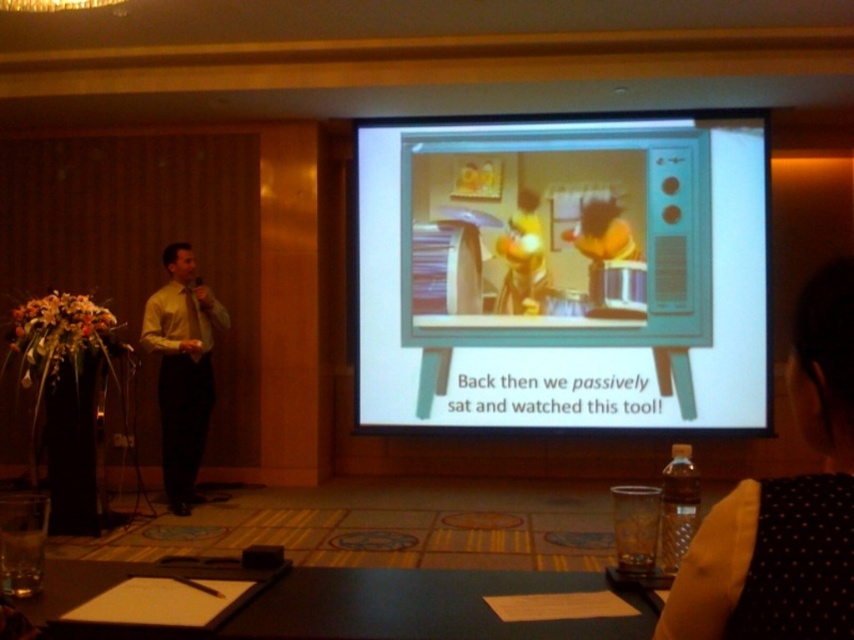
You are a presenter who needs to place a 4 meter long banner between the matte plastic television at center and the black leather table at lower center. Is there enough space to place it without bending the banner?

The distance between the matte plastic television at center and the black leather table at lower center is 4.13 meters, so yes, the banner can be placed between them without bending since it is slightly longer than the required space.

You are standing in the conference room and want to place a new projector on the table. The projector requires a space of 30 cm x 30 cm. Can the matte plastic television at center be moved to the right side of the table to accommodate the projector?

The matte plastic television at center is located at point (563,275). Moving it to the right side of the table would depend on the table dimensions and available space, but since the exact table size isn

Looking at this image, you are organizing a small event in this room and need to place a 1.2 meter tall decoration between the matte plastic television at center and the black dotted dress at upper right. Will there be enough vertical space for the decoration?

The matte plastic television at center is much taller than the black dotted dress at upper right, so there should be enough vertical space between them to accommodate the 1.2 meter tall decoration.